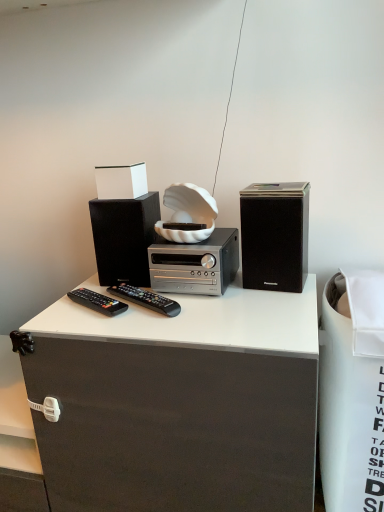
Question: Does silver metallic stereo at center have a smaller size compared to black plastic remote at center, the 1th remote control in the right-to-left sequence?

Choices:
 (A) no
 (B) yes

Answer: (A)

Question: From a real-world perspective, is silver metallic stereo at center positioned under black plastic remote at center, the 1th remote control in the right-to-left sequence, based on gravity?

Choices:
 (A) no
 (B) yes

Answer: (A)

Question: Is silver metallic stereo at center further to camera compared to black plastic remote at center, which is the 2th remote control in left-to-right order?

Choices:
 (A) no
 (B) yes

Answer: (B)

Question: From the image's perspective, is silver metallic stereo at center beneath black plastic remote at center, which is the 2th remote control in left-to-right order?

Choices:
 (A) no
 (B) yes

Answer: (A)

Question: Considering the relative positions of silver metallic stereo at center and black plastic remote at center, the 1th remote control in the right-to-left sequence, in the image provided, is silver metallic stereo at center in front of black plastic remote at center, the 1th remote control in the right-to-left sequence,?

Choices:
 (A) no
 (B) yes

Answer: (A)

Question: From the image's perspective, is black plastic remote at center, which is the 2th remote control in left-to-right order, located above or below black matte speaker at right, which is counted as the first loudspeaker, starting from the right?

Choices:
 (A) below
 (B) above

Answer: (A)

Question: In terms of size, does black plastic remote at center, the 1th remote control in the right-to-left sequence, appear bigger or smaller than black matte speaker at right, which is the second loudspeaker in left-to-right order?

Choices:
 (A) big
 (B) small

Answer: (B)

Question: From a real-world perspective, is black plastic remote at center, which is the 2th remote control in left-to-right order, physically located above or below black matte speaker at right, which is counted as the first loudspeaker, starting from the right?

Choices:
 (A) above
 (B) below

Answer: (B)

Question: Is point (155, 309) closer or farther from the camera than point (248, 207)?

Choices:
 (A) farther
 (B) closer

Answer: (B)

Question: Considering the relative positions of black plastic remote at center, which is the 2th remote control in left-to-right order, and white fabric trash bin at right in the image provided, is black plastic remote at center, which is the 2th remote control in left-to-right order, to the left or to the right of white fabric trash bin at right?

Choices:
 (A) left
 (B) right

Answer: (A)

Question: Is black plastic remote at center, the 1th remote control in the right-to-left sequence, bigger or smaller than white fabric trash bin at right?

Choices:
 (A) big
 (B) small

Answer: (B)

Question: Is black plastic remote at center, which is the 2th remote control in left-to-right order, inside or outside of white fabric trash bin at right?

Choices:
 (A) inside
 (B) outside

Answer: (B)

Question: Looking at their shapes, would you say black plastic remote at center, which is the 2th remote control in left-to-right order, is wider or thinner than white fabric trash bin at right?

Choices:
 (A) thin
 (B) wide

Answer: (A)

Question: Does point (158, 206) appear closer or farther from the camera than point (117, 290)?

Choices:
 (A) farther
 (B) closer

Answer: (A)

Question: Do you think black matte speaker at left, which is counted as the first loudspeaker, starting from the left, is within black plastic remote at center, which is the 2th remote control in left-to-right order, or outside of it?

Choices:
 (A) inside
 (B) outside

Answer: (B)